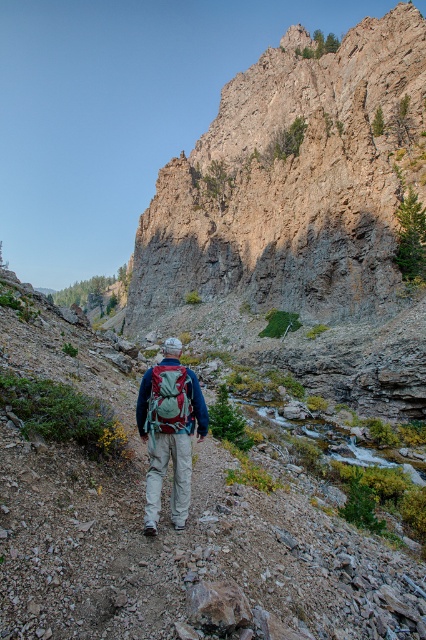
Question: Can you confirm if rugged stone cliff at upper center is wider than teal fabric backpack at center?

Choices:
 (A) no
 (B) yes

Answer: (B)

Question: Is rugged stone cliff at upper center thinner than matte green backpack at center?

Choices:
 (A) no
 (B) yes

Answer: (A)

Question: Does rugged stone cliff at upper center appear on the left side of matte green backpack at center?

Choices:
 (A) no
 (B) yes

Answer: (A)

Question: Which point appears closest to the camera in this image?

Choices:
 (A) (175, 397)
 (B) (193, 397)

Answer: (A)

Question: Which object appears closest to the camera in this image?

Choices:
 (A) teal fabric backpack at center
 (B) rugged stone cliff at upper center

Answer: (A)

Question: Which is nearer to the teal fabric backpack at center?

Choices:
 (A) matte green backpack at center
 (B) rugged stone cliff at upper center

Answer: (A)